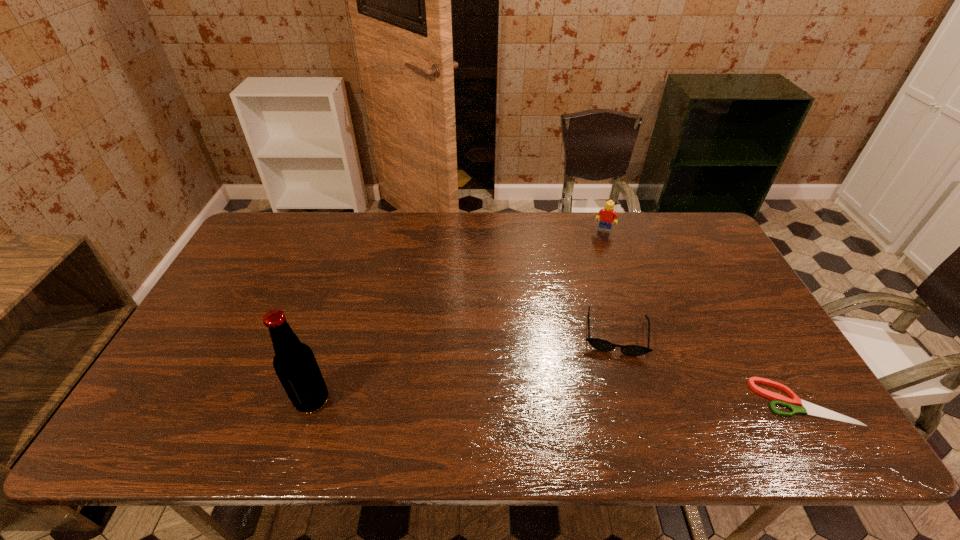
Locate an element on the screen. Image resolution: width=960 pixels, height=540 pixels. vacant point at the far edge is located at coordinates (354, 219).

This screenshot has width=960, height=540. Find the location of `vacant position at the near edge of the desktop`. vacant position at the near edge of the desktop is located at coordinates (255, 406).

You are a GUI agent. You are given a task and a screenshot of the screen. Output one action in this format:
    pyautogui.click(x=<x>, y=<y>)
    Task: Click on the vacant space at the left edge of the desktop
    The image size is (960, 540).
    Given the screenshot: What is the action you would take?
    pyautogui.click(x=242, y=293)

I want to click on vacant space at the right edge of the desktop, so click(x=753, y=372).

The height and width of the screenshot is (540, 960). In order to click on free space at the near left corner in this screenshot , I will do `click(204, 377)`.

Locate an element on the screen. The height and width of the screenshot is (540, 960). vacant space that's between the second tallest object and the second farthest object is located at coordinates (610, 281).

Locate an element on the screen. Image resolution: width=960 pixels, height=540 pixels. free spot between the sunglasses and the shortest object is located at coordinates (709, 367).

The width and height of the screenshot is (960, 540). In order to click on unoccupied area between the shortest object and the second farthest object in this screenshot , I will do `click(709, 367)`.

Locate an element on the screen. This screenshot has width=960, height=540. vacant point located between the third shortest object and the sunglasses is located at coordinates (610, 281).

At what (x,y) coordinates should I click in order to perform the action: click on vacant space that's between the second shortest object and the third shortest object. Please return your answer as a coordinate pair (x, y). Looking at the image, I should click on (610, 281).